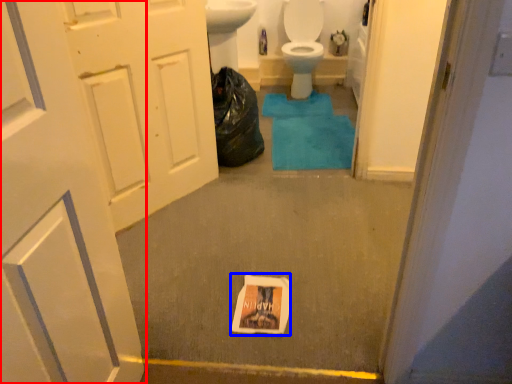
Question: Among these objects, which one is nearest to the camera, door (highlighted by a red box) or flyer (highlighted by a blue box)?

Choices:
 (A) door
 (B) flyer

Answer: (A)